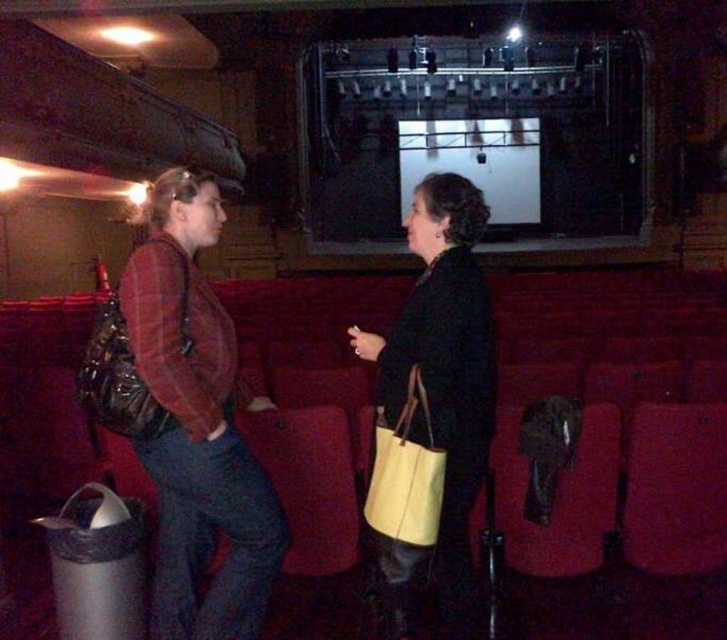
Can you confirm if plaid fabric jacket at left is positioned to the left of yellow fabric tote at center?

Yes, plaid fabric jacket at left is to the left of yellow fabric tote at center.

Can you confirm if plaid fabric jacket at left is taller than yellow fabric tote at center?

Indeed, plaid fabric jacket at left has a greater height compared to yellow fabric tote at center.

You are a GUI agent. You are given a task and a screenshot of the screen. Output one action in this format:
    pyautogui.click(x=<x>, y=<y>)
    Task: Click on the plaid fabric jacket at left
    The image size is (727, 640).
    Given the screenshot: What is the action you would take?
    pos(196,424)

Who is taller, matte yellow tote bag at center or yellow fabric tote at center?

matte yellow tote bag at center is taller.

Is the position of matte yellow tote bag at center more distant than that of yellow fabric tote at center?

Yes.

What do you see at coordinates (445, 362) in the screenshot? I see `matte yellow tote bag at center` at bounding box center [445, 362].

What are the coordinates of `matte yellow tote bag at center` in the screenshot? It's located at (445, 362).

Who is lower down, plaid fabric jacket at left or matte yellow tote bag at center?

plaid fabric jacket at left is lower down.

Does point (204, 538) come behind point (435, 392)?

That is True.

At what (x,y) coordinates should I click in order to perform the action: click on plaid fabric jacket at left. Please return your answer as a coordinate pair (x, y). Looking at the image, I should click on (196, 424).